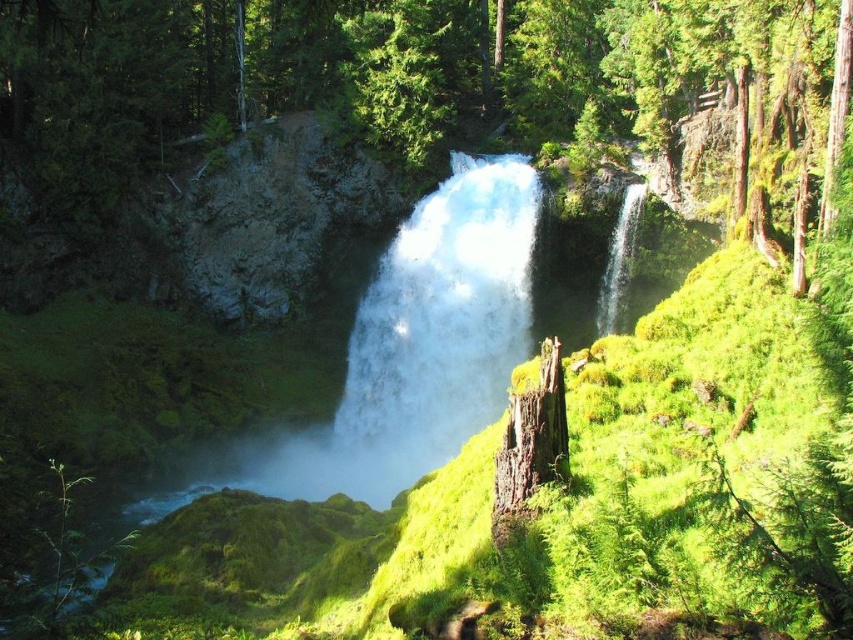
You are standing at the base of the waterfall and want to reach both points marked in the image. Which point, point (370, 422) or point (538, 458), is closer to you?

Point (370, 422) is closer to you because it is further to the viewer than point (538, 458).

Looking at this image, you are standing at the base of the waterfall and want to determine which of the two points, point (171, 125) or point (389, 332), is closer to you. Based on the scene description, which point is nearer?

Point (171, 125) is closer to you because it is further to the viewer than point (389, 332).

You are standing at the base of the waterfall and want to reach a hidden cave located at point (x=445, y=140). There is an obstacle at point (x=538, y=484) blocking your path. Can you safely navigate around the obstacle to reach the cave?

Since point (x=445, y=140) is behind point (x=538, y=484), you can safely navigate around the obstacle by moving around it to access the cave location behind.